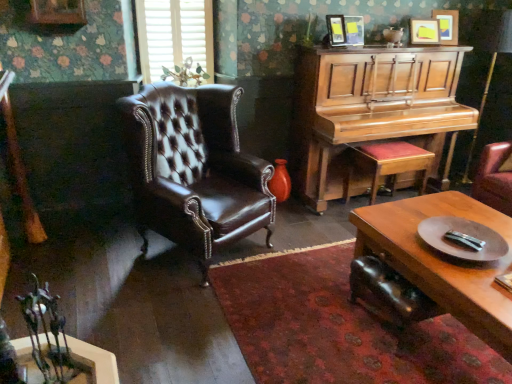
Where is `free space underneath wooden picture frame at upper right, the 2th picture frame in the right-to-left sequence (from a real-world perspective)`? The height and width of the screenshot is (384, 512). free space underneath wooden picture frame at upper right, the 2th picture frame in the right-to-left sequence (from a real-world perspective) is located at coordinates (417, 48).